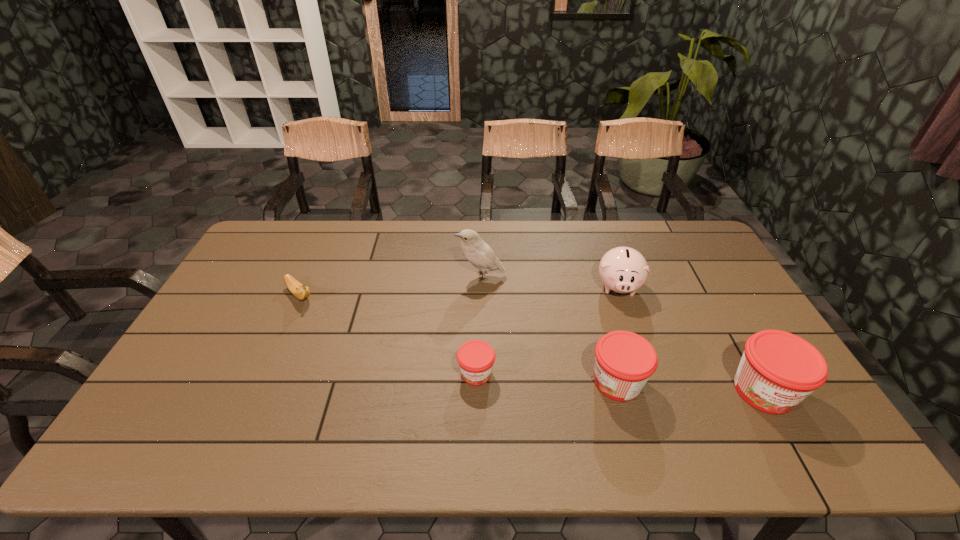
Please point a spot to add another jam on the left. Please provide its 2D coordinates. Your answer should be formatted as a tuple, i.e. [(x, y)], where the tuple contains the x and y coordinates of a point satisfying the conditions above.

[(340, 365)]